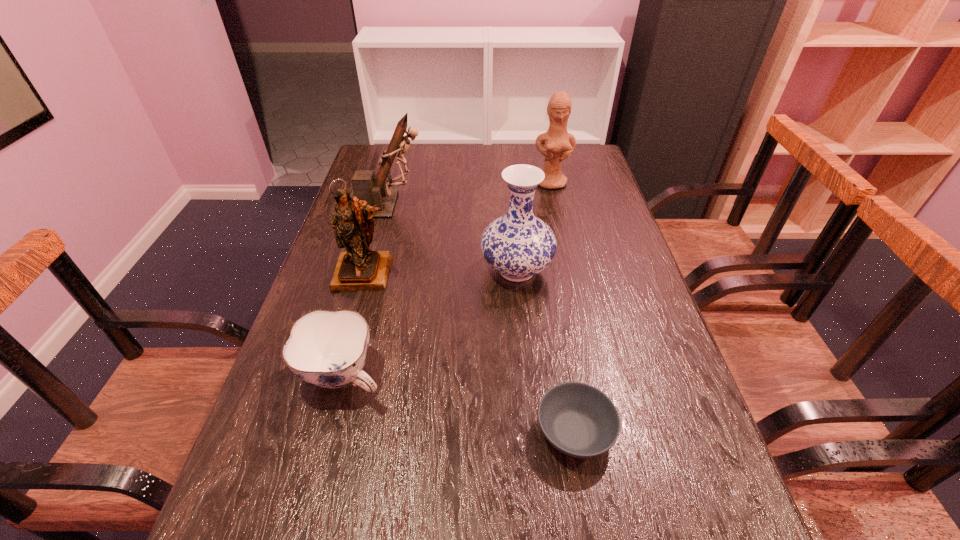
Locate an element on the screen. The width and height of the screenshot is (960, 540). the rightmost figurine is located at coordinates (559, 144).

Find the location of `vase`. vase is located at coordinates (518, 245).

Identify the location of the nearest figurine. The image size is (960, 540). (360, 268).

At what (x,y) coordinates should I click in order to perform the action: click on the second shortest object. Please return your answer as a coordinate pair (x, y). This screenshot has height=540, width=960. Looking at the image, I should click on (328, 349).

Image resolution: width=960 pixels, height=540 pixels. I want to click on soup bowl, so click(579, 420).

You are a GUI agent. You are given a task and a screenshot of the screen. Output one action in this format:
    pyautogui.click(x=<x>, y=<y>)
    Task: Click on the free space located on the front-facing side of the rightmost figurine
    The image size is (960, 540).
    Given the screenshot: What is the action you would take?
    pyautogui.click(x=567, y=256)

The width and height of the screenshot is (960, 540). I want to click on vacant space located 0.190m on the left of the vase, so click(x=406, y=270).

Locate an element on the screen. The image size is (960, 540). vacant space located on the front-facing side of the nearest figurine is located at coordinates (324, 418).

Locate an element on the screen. free space located on the right of the fifth tallest object is located at coordinates (467, 375).

Identify the location of vacant space located 0.310m on the back of the shortest object. (550, 287).